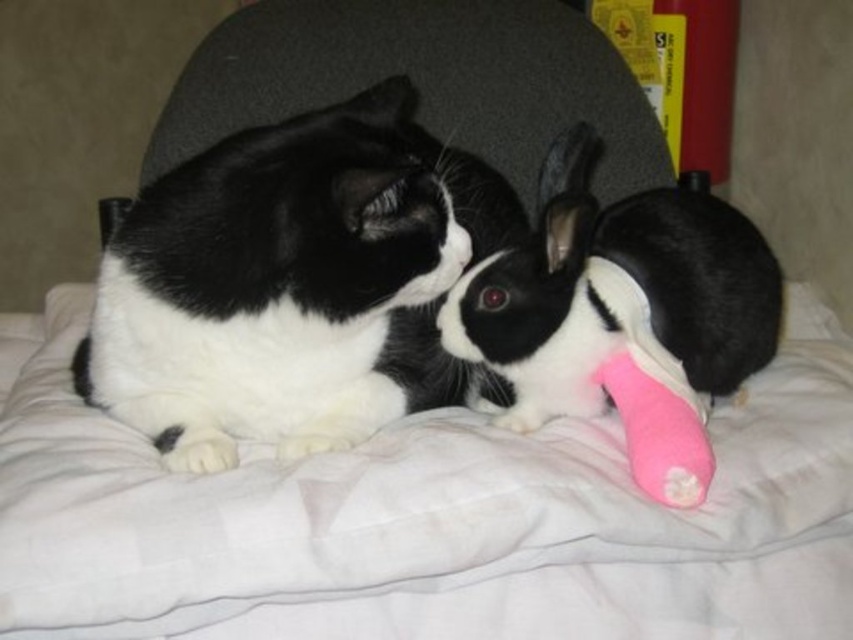
Question: From the image, what is the correct spatial relationship of black/white fur cat at upper left in relation to pink rubber toy at center?

Choices:
 (A) right
 (B) left

Answer: (B)

Question: Which point is closer to the camera?

Choices:
 (A) (619, 333)
 (B) (352, 124)

Answer: (B)

Question: Is black/white fur cat at upper left behind pink rubber toy at center?

Choices:
 (A) yes
 (B) no

Answer: (B)

Question: Among these objects, which one is farthest from the camera?

Choices:
 (A) black/white fur cat at upper left
 (B) pink rubber toy at center

Answer: (B)

Question: Where is black/white fur cat at upper left located in relation to pink rubber toy at center in the image?

Choices:
 (A) above
 (B) below

Answer: (A)